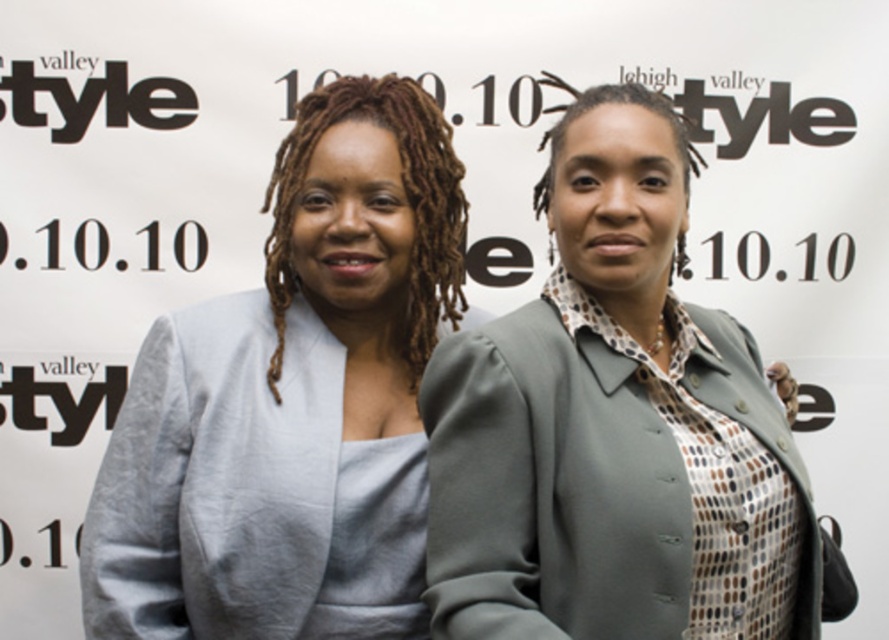
Between matte gray blazer at center and matte gray blazer at left, which one is positioned lower?

matte gray blazer at left is lower down.

Based on the photo, is the position of matte gray blazer at center more distant than that of matte gray blazer at left?

No, it is in front of matte gray blazer at left.

Identify the location of matte gray blazer at center. This screenshot has width=889, height=640. (613, 428).